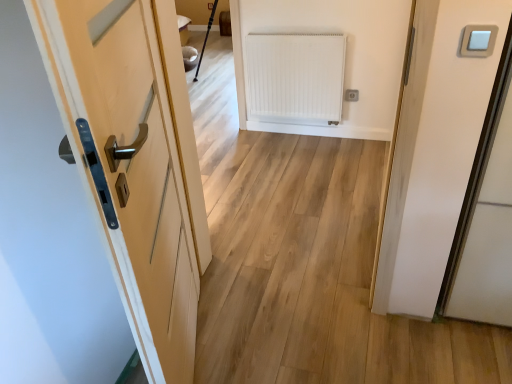
Find the location of a particular element. The height and width of the screenshot is (384, 512). white plastic light switch at upper right is located at coordinates (478, 40).

What is the approximate width of white plastic electric outlet at upper right?

The width of white plastic electric outlet at upper right is 0.82 inches.

Identify the location of matte wood door at left. This screenshot has width=512, height=384. (135, 168).

Is white plastic light switch at upper right inside the boundaries of white plastic electric outlet at upper right, or outside?

white plastic light switch at upper right is outside white plastic electric outlet at upper right.

Which is in front, point (465, 39) or point (345, 100)?

The point (465, 39) is more forward.

From a real-world perspective, is white plastic light switch at upper right physically above white plastic electric outlet at upper right?

Yes, from a real-world perspective, white plastic light switch at upper right is over white plastic electric outlet at upper right

Does white plastic light switch at upper right touch white plastic electric outlet at upper right?

No, white plastic light switch at upper right is not in contact with white plastic electric outlet at upper right.

Who is bigger, white plastic electric outlet at upper right or white matte radiator at center?

white matte radiator at center is bigger.

Can you confirm if white plastic electric outlet at upper right is thinner than white matte radiator at center?

Yes, white plastic electric outlet at upper right is thinner than white matte radiator at center.

Considering the sizes of matte wood door at left and white plastic light switch at upper right in the image, is matte wood door at left taller or shorter than white plastic light switch at upper right?

matte wood door at left is taller than white plastic light switch at upper right.

At what (x,y) coordinates should I click in order to perform the action: click on light switch lying above the matte wood door at left (from the image's perspective). Please return your answer as a coordinate pair (x, y). Looking at the image, I should click on (478, 40).

Is the surface of matte wood door at left in direct contact with white plastic light switch at upper right?

matte wood door at left and white plastic light switch at upper right are not in contact.

Is matte wood door at left facing away from white plastic light switch at upper right?

matte wood door at left is not turned away from white plastic light switch at upper right.

The image size is (512, 384). I want to click on electric outlet lying on the right of white matte radiator at center, so click(x=352, y=95).

Is white matte radiator at center wider than white plastic electric outlet at upper right?

Yes.

Looking at this image, from the image's perspective, which one is positioned higher, white matte radiator at center or white plastic electric outlet at upper right?

white matte radiator at center.

Which object is positioned more to the left, white matte radiator at center or white plastic electric outlet at upper right?

Positioned to the left is white matte radiator at center.

From the image's perspective, which is below, matte wood door at left or white matte radiator at center?

matte wood door at left.

Is matte wood door at left facing away from white matte radiator at center?

No, matte wood door at left is not facing the opposite direction of white matte radiator at center.

Looking at this image, does matte wood door at left have a lesser width compared to white matte radiator at center?

No.

You are a GUI agent. You are given a task and a screenshot of the screen. Output one action in this format:
    pyautogui.click(x=<x>, y=<y>)
    Task: Click on the door on the left of white matte radiator at center
    This screenshot has height=384, width=512.
    Given the screenshot: What is the action you would take?
    pyautogui.click(x=135, y=168)

Considering the positions of point (124, 125) and point (357, 96), is point (124, 125) closer or farther from the camera than point (357, 96)?

Point (124, 125).

Considering the sizes of objects matte wood door at left and white plastic electric outlet at upper right in the image provided, who is thinner, matte wood door at left or white plastic electric outlet at upper right?

white plastic electric outlet at upper right.

Is matte wood door at left turned away from white plastic electric outlet at upper right?

matte wood door at left is not turned away from white plastic electric outlet at upper right.

Consider the image. Is matte wood door at left at the right side of white plastic electric outlet at upper right?

In fact, matte wood door at left is to the left of white plastic electric outlet at upper right.

Consider the image. How much distance is there between white matte radiator at center and matte wood door at left?

6.00 feet.

Considering the positions of points (278, 95) and (102, 131), is point (278, 95) closer to camera compared to point (102, 131)?

No, (278, 95) is behind (102, 131).

Considering their positions, is white matte radiator at center located in front of or behind matte wood door at left?

white matte radiator at center is positioned farther from the viewer than matte wood door at left.

Which object is positioned more to the left, white matte radiator at center or matte wood door at left?

matte wood door at left.

At what (x,y) coordinates should I click in order to perform the action: click on light switch on the left of the white plastic electric outlet at upper right. Please return your answer as a coordinate pair (x, y). This screenshot has height=384, width=512. Looking at the image, I should click on (478, 40).

Locate an element on the screen. The image size is (512, 384). electric outlet on the right of white matte radiator at center is located at coordinates (x=352, y=95).

When comparing their distances from matte wood door at left, does white plastic light switch at upper right or white plastic electric outlet at upper right seem closer?

Among the two, white plastic light switch at upper right is located nearer to matte wood door at left.

Looking at the image, which one is located further to white plastic electric outlet at upper right, white plastic light switch at upper right or matte wood door at left?

Among the two, matte wood door at left is located further to white plastic electric outlet at upper right.

From the image, which object appears to be nearer to white plastic light switch at upper right, matte wood door at left or white plastic electric outlet at upper right?

matte wood door at left is closer to white plastic light switch at upper right.

Looking at the image, which one is located further to white plastic light switch at upper right, white plastic electric outlet at upper right or white matte radiator at center?

white matte radiator at center is positioned further to the anchor white plastic light switch at upper right.

Estimate the real-world distances between objects in this image. Which object is further from white matte radiator at center, white plastic light switch at upper right or matte wood door at left?

white plastic light switch at upper right lies further to white matte radiator at center than the other object.

Based on the photo, estimate the real-world distances between objects in this image. Which object is closer to white plastic light switch at upper right, white plastic electric outlet at upper right or matte wood door at left?

matte wood door at left is positioned closer to the anchor white plastic light switch at upper right.

Which object lies further to the anchor point matte wood door at left, white matte radiator at center or white plastic electric outlet at upper right?

The object further to matte wood door at left is white plastic electric outlet at upper right.

Looking at this image, estimate the real-world distances between objects in this image. Which object is closer to white plastic electric outlet at upper right, white plastic light switch at upper right or white matte radiator at center?

Based on the image, white matte radiator at center appears to be nearer to white plastic electric outlet at upper right.

Identify the location of light switch between matte wood door at left and white matte radiator at center in the front-back direction. The height and width of the screenshot is (384, 512). (478, 40).

I want to click on radiator between white plastic light switch at upper right and white plastic electric outlet at upper right along the z-axis, so click(295, 78).

In order to click on radiator between matte wood door at left and white plastic electric outlet at upper right from front to back in this screenshot , I will do `click(295, 78)`.

Identify the location of light switch between matte wood door at left and white plastic electric outlet at upper right from front to back. This screenshot has width=512, height=384. (478, 40).